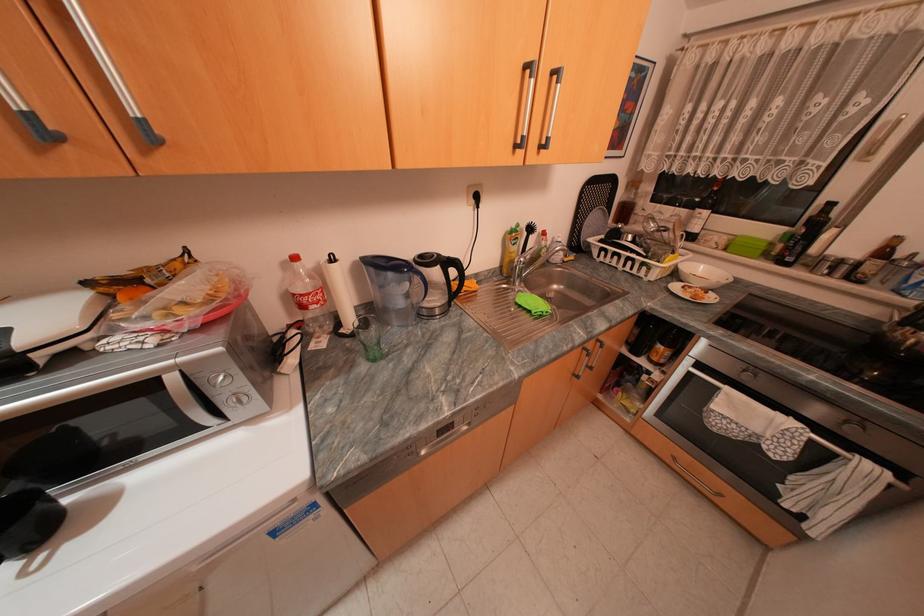
Which object does [509,249] point to?

It corresponds to the yellow soap bottle in the image.